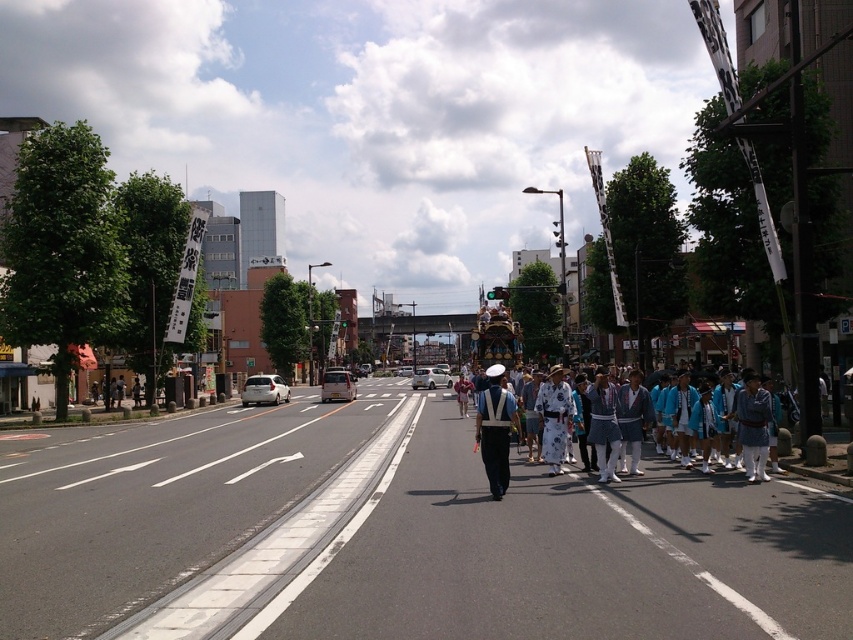
You are a photographer positioned on the street during the festival. You want to capture a photo of the two people in the white uniform at center and the matte black uniform at center. Which one should you focus on first if you want to include both in your frame without moving the camera?

The matte black uniform at center should be focused on first since the white uniform at center is to its right, allowing you to frame both by adjusting the focus from left to right.

You are a photographer standing at the corner of the street. You want to take a photo of the white uniform at center. Where should you position your camera to capture the subject in the best possible frame?

The white uniform at center is located at coordinates point [605,424]. To capture it effectively, position your camera so that the subject is centered within the frame, aligning with these coordinates for optimal focus and composition.

You are a photographer standing on the sidewalk during the festival. You want to take a photo of both the white uniform at center and the matte black uniform at center. The minimum distance between the subjects for your camera to focus properly is 5 feet. Can you capture both subjects in focus?

The white uniform at center is 6.37 feet from matte black uniform at center. Since the distance between them is greater than the 5 feet minimum requirement, you can capture both subjects in focus.